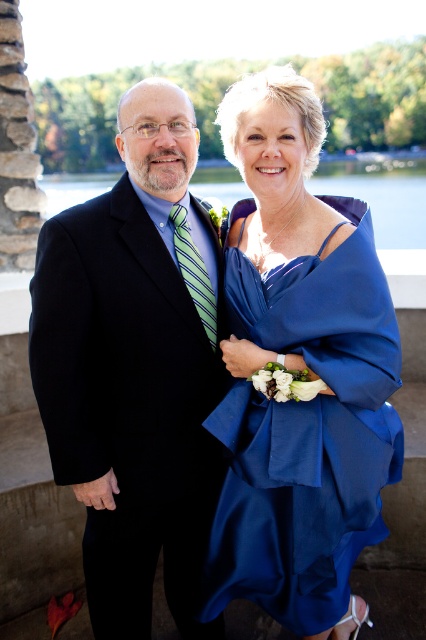
Question: Is the position of matte black suit at left less distant than that of blue satin dress at upper center?

Choices:
 (A) yes
 (B) no

Answer: (A)

Question: Which of the following is the closest to the observer?

Choices:
 (A) blue satin dress at upper center
 (B) matte black suit at left

Answer: (B)

Question: Is satin blue dress at center to the left of blue satin dress at upper center from the viewer's perspective?

Choices:
 (A) no
 (B) yes

Answer: (B)

Question: Does matte black suit at left have a smaller size compared to blue satin dress at upper center?

Choices:
 (A) yes
 (B) no

Answer: (A)

Question: Among these points, which one is nearest to the camera?

Choices:
 (A) 370,182
 (B) 340,410
 (C) 92,536

Answer: (B)

Question: Which point is farther to the camera?

Choices:
 (A) matte black suit at left
 (B) blue satin dress at upper center

Answer: (B)